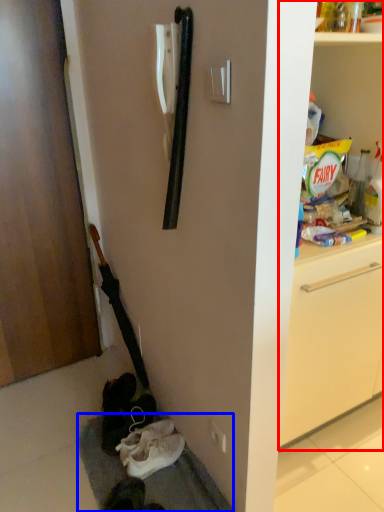
Question: Which object is further to the camera taking this photo, shelf (highlighted by a red box) or gray (highlighted by a blue box)?

Choices:
 (A) shelf
 (B) gray

Answer: (B)